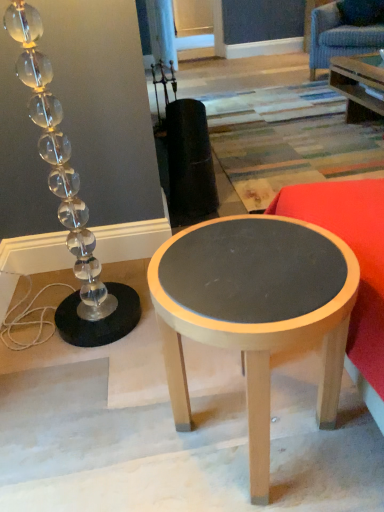
I want to click on free space in front of clear glass lamp at left, so click(82, 395).